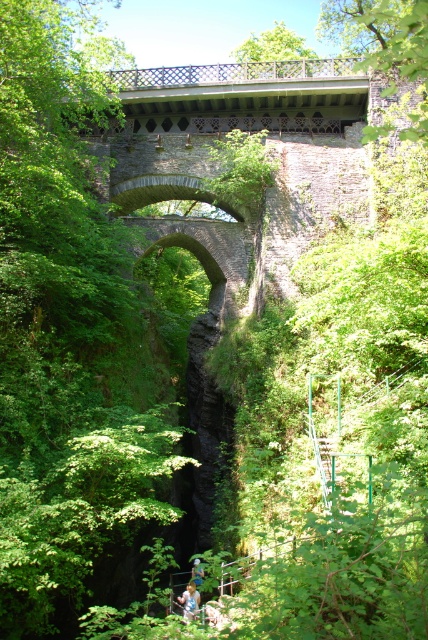
Question: Estimate the real-world distances between objects in this image. Which object is farther from the green leafy tree at upper center?

Choices:
 (A) green leafy tree at center
 (B) green leafy tree at upper right
 (C) light blue fabric at lower center

Answer: (C)

Question: Which point is closer to the camera?

Choices:
 (A) white plastic helmet at center
 (B) green leafy tree at center
 (C) light blue fabric at lower center
 (D) green leafy tree at upper right

Answer: (D)

Question: Which object is positioned farthest from the green leafy tree at upper center?

Choices:
 (A) white plastic helmet at center
 (B) green leafy tree at center
 (C) green leafy tree at upper right

Answer: (A)

Question: Is green leafy tree at center above green leafy tree at upper right?

Choices:
 (A) no
 (B) yes

Answer: (A)

Question: Is green leafy tree at center above light blue fabric at lower center?

Choices:
 (A) no
 (B) yes

Answer: (B)

Question: Is green leafy tree at center in front of green leafy tree at upper right?

Choices:
 (A) yes
 (B) no

Answer: (B)